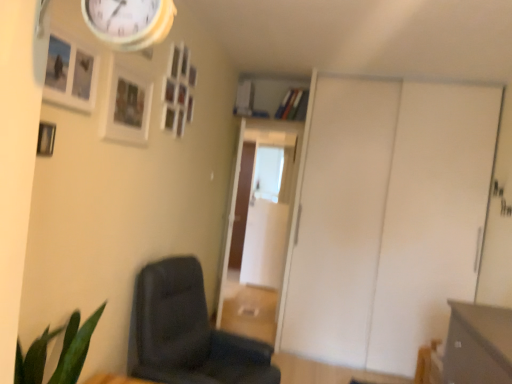
Question: From a real-world perspective, is white matte sliding door at right below matte gray drawer at lower right?

Choices:
 (A) yes
 (B) no

Answer: (B)

Question: Is white matte sliding door at right aimed at matte gray drawer at lower right?

Choices:
 (A) yes
 (B) no

Answer: (A)

Question: Is white matte sliding door at right at the right side of matte gray drawer at lower right?

Choices:
 (A) no
 (B) yes

Answer: (A)

Question: Is white matte sliding door at right bigger than matte gray drawer at lower right?

Choices:
 (A) no
 (B) yes

Answer: (B)

Question: Does white matte sliding door at right have a lesser height compared to matte gray drawer at lower right?

Choices:
 (A) no
 (B) yes

Answer: (A)

Question: Visually, is wooden picture frame at upper left, which appears as the third picture frame when viewed from the front, positioned to the left or to the right of white matte sliding door at right?

Choices:
 (A) left
 (B) right

Answer: (A)

Question: Looking at the image, does wooden picture frame at upper left, the second picture frame from the back, seem bigger or smaller compared to white matte sliding door at right?

Choices:
 (A) big
 (B) small

Answer: (B)

Question: From a real-world perspective, relative to white matte sliding door at right, is wooden picture frame at upper left, the second picture frame from the back, vertically above or below?

Choices:
 (A) below
 (B) above

Answer: (B)

Question: From the image's perspective, is wooden picture frame at upper left, which appears as the third picture frame when viewed from the front, located above or below white matte sliding door at right?

Choices:
 (A) above
 (B) below

Answer: (A)

Question: Which is correct: dark gray fabric chair at lower left is inside matte gray drawer at lower right, or outside of it?

Choices:
 (A) inside
 (B) outside

Answer: (B)

Question: Looking at the image, does dark gray fabric chair at lower left seem bigger or smaller compared to matte gray drawer at lower right?

Choices:
 (A) big
 (B) small

Answer: (A)

Question: From a real-world perspective, is dark gray fabric chair at lower left physically located above or below matte gray drawer at lower right?

Choices:
 (A) below
 (B) above

Answer: (A)

Question: Considering their positions, is dark gray fabric chair at lower left located in front of or behind matte gray drawer at lower right?

Choices:
 (A) front
 (B) behind

Answer: (B)

Question: In terms of height, does wooden picture frame at upper left, the 1th picture frame in the front-to-back sequence, look taller or shorter compared to transparent glass door at center, which is counted as the second glass door, starting from the back?

Choices:
 (A) tall
 (B) short

Answer: (B)

Question: Is wooden picture frame at upper left, the fourth picture frame when ordered from back to front, wider or thinner than transparent glass door at center, which is counted as the second glass door, starting from the back?

Choices:
 (A) thin
 (B) wide

Answer: (A)